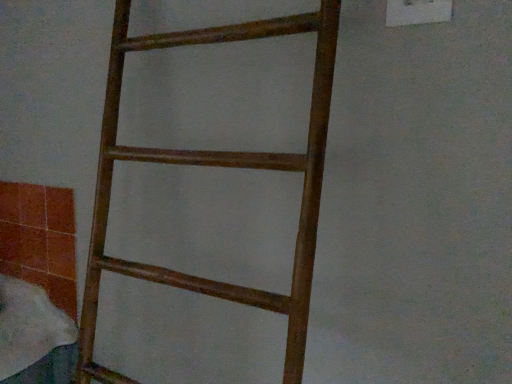
Locate an element on the screen. This screenshot has width=512, height=384. wooden ladder at center is located at coordinates (216, 166).

What do you see at coordinates (216, 166) in the screenshot?
I see `wooden ladder at center` at bounding box center [216, 166].

Measure the distance between point (106, 99) and camera.

Point (106, 99) and camera are 82.70 centimeters apart.

The height and width of the screenshot is (384, 512). What are the coordinates of `wooden ladder at center` in the screenshot? It's located at (216, 166).